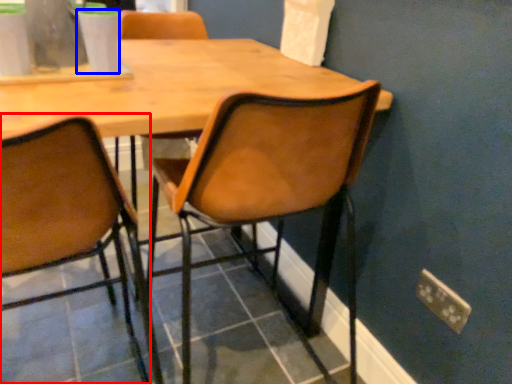
Question: Which object appears closest to the camera in this image, chair (highlighted by a red box) or coffee cup (highlighted by a blue box)?

Choices:
 (A) chair
 (B) coffee cup

Answer: (A)